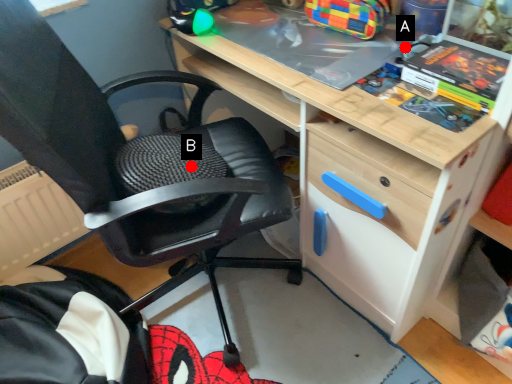
Question: Two points are circled on the image, labeled by A and B beside each circle. Among these points, which one is farthest from the camera?

Choices:
 (A) A is further
 (B) B is further

Answer: (B)